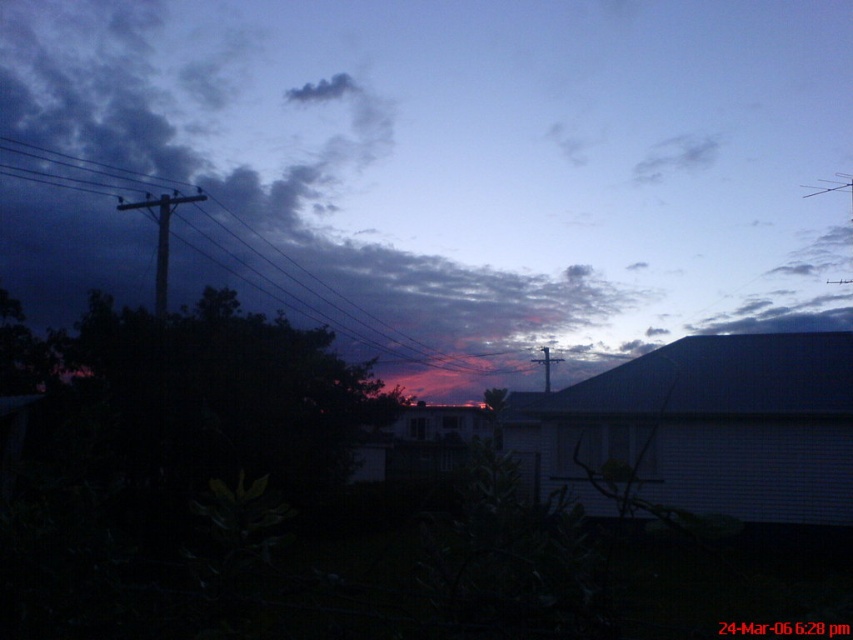
Question: Which of these objects is positioned closest to the smooth wooden telegraph pole at left?

Choices:
 (A) metallic wire at center
 (B) matte dark blue sky at upper center
 (C) black wire at upper left

Answer: (C)

Question: Does smooth wooden telegraph pole at left have a larger size compared to metallic wire at center?

Choices:
 (A) no
 (B) yes

Answer: (B)

Question: Can you confirm if smooth wooden telegraph pole at left is wider than metallic wire at center?

Choices:
 (A) yes
 (B) no

Answer: (A)

Question: Can you confirm if matte dark blue sky at upper center is positioned to the left of smooth wooden telegraph pole at left?

Choices:
 (A) yes
 (B) no

Answer: (B)

Question: Which of the following is the closest to the observer?

Choices:
 (A) (320, 38)
 (B) (549, 365)
 (C) (102, 163)

Answer: (B)

Question: Which of the following is the closest to the observer?

Choices:
 (A) (x=172, y=204)
 (B) (x=209, y=212)
 (C) (x=546, y=353)

Answer: (A)